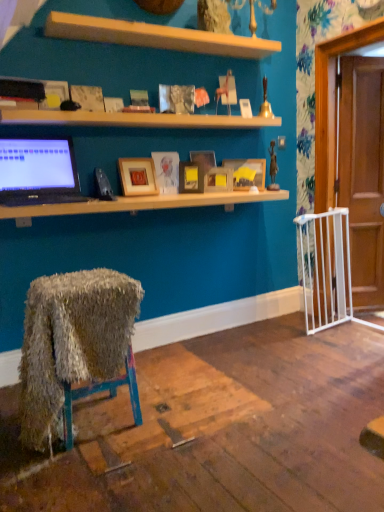
Find the location of a particular element. free space in front of matte wooden picture frame at center, placed as the fifth picture frame when sorted from left to right is located at coordinates (213, 198).